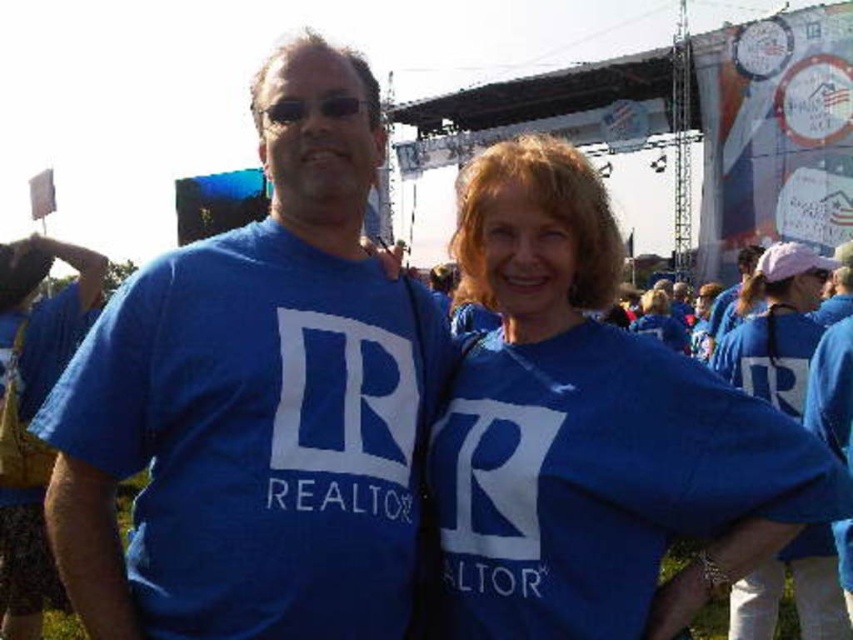
Question: Which point is farther to the camera?

Choices:
 (A) (793, 324)
 (B) (651, 317)
 (C) (531, 483)

Answer: (B)

Question: Is matte blue shirt at left wider than matte blue shirt at center?

Choices:
 (A) no
 (B) yes

Answer: (B)

Question: Is matte blue shirt at center smaller than blue fabric shirt at center?

Choices:
 (A) yes
 (B) no

Answer: (B)

Question: Which is nearer to the matte blue shirt at left?

Choices:
 (A) matte blue shirt at right
 (B) matte blue shirt at center

Answer: (B)

Question: Can you confirm if matte blue shirt at left is bigger than blue fabric shirt at center?

Choices:
 (A) yes
 (B) no

Answer: (A)

Question: Which of the following is the closest to the observer?

Choices:
 (A) (648, 294)
 (B) (85, 355)

Answer: (B)